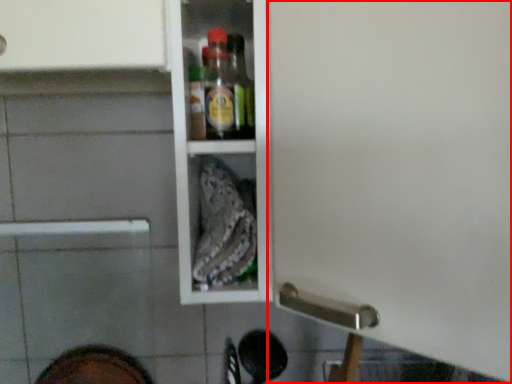
Question: In this image, where is screen door (annotated by the red box) located relative to footwear?

Choices:
 (A) left
 (B) right

Answer: (B)